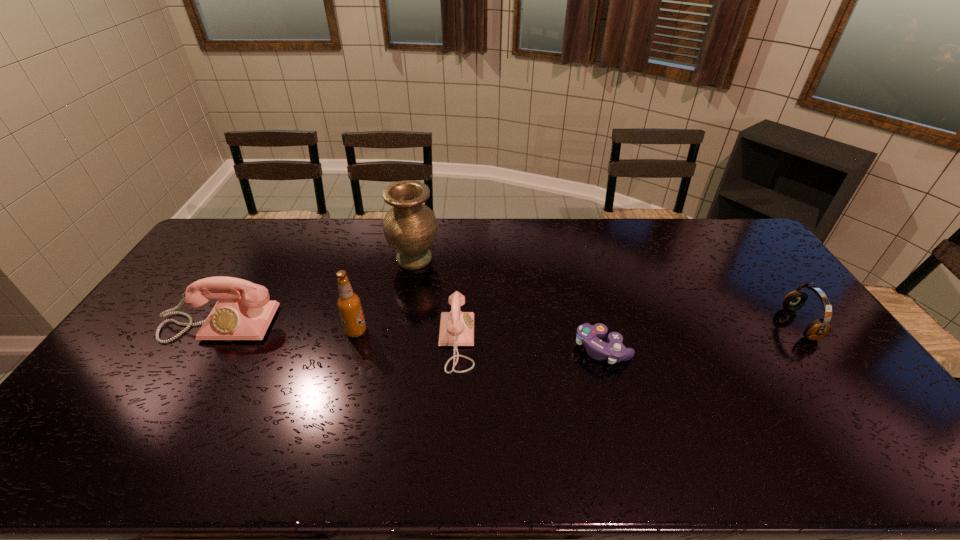
Given the evenly spaced telephones in the image, where should an extra telephone be added on the right to preserve the spacing? Please point to a vacant space. Please provide its 2D coordinates. Your answer should be formatted as a tuple, i.e. [(x, y)], where the tuple contains the x and y coordinates of a point satisfying the conditions above.

[(714, 361)]